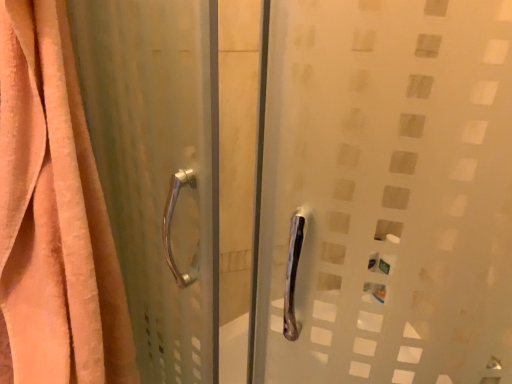
Question: Choose the correct answer: Is orange velvety curtain at left inside satin silver handle at left or outside it?

Choices:
 (A) outside
 (B) inside

Answer: (A)

Question: Is point (86, 342) positioned closer to the camera than point (181, 195)?

Choices:
 (A) farther
 (B) closer

Answer: (A)

Question: Looking at their shapes, would you say orange velvety curtain at left is wider or thinner than satin silver handle at left?

Choices:
 (A) wide
 (B) thin

Answer: (A)

Question: Does point (151, 150) appear closer or farther from the camera than point (24, 122)?

Choices:
 (A) closer
 (B) farther

Answer: (B)

Question: Is satin silver handle at left situated inside orange velvety curtain at left or outside?

Choices:
 (A) outside
 (B) inside

Answer: (A)

Question: In terms of width, does satin silver handle at left look wider or thinner when compared to orange velvety curtain at left?

Choices:
 (A) wide
 (B) thin

Answer: (B)

Question: Would you say satin silver handle at left is to the left or to the right of orange velvety curtain at left in the picture?

Choices:
 (A) left
 (B) right

Answer: (B)